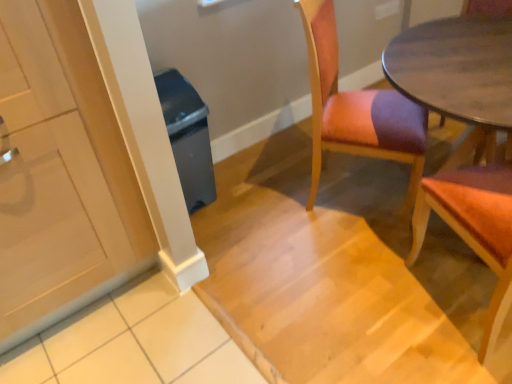
The height and width of the screenshot is (384, 512). What do you see at coordinates (356, 108) in the screenshot?
I see `wooden upholstered chair at center, acting as the 2th chair starting from the right` at bounding box center [356, 108].

Identify the location of white glossy cabinet at left. The image size is (512, 384). (61, 173).

Image resolution: width=512 pixels, height=384 pixels. What are the coordinates of `wooden upholstered chair at center, acting as the 2th chair starting from the right` in the screenshot? It's located at (356, 108).

Relative to wooden upholstered chair at center, the first chair viewed from the left, is wooden chair at right, marked as the first chair in a right-to-left arrangement, in front or behind?

wooden chair at right, marked as the first chair in a right-to-left arrangement, is positioned closer to the viewer than wooden upholstered chair at center, the first chair viewed from the left.

Considering the relative positions of wooden chair at right, arranged as the 2th chair when viewed from the left, and wooden upholstered chair at center, acting as the 2th chair starting from the right, in the image provided, is wooden chair at right, arranged as the 2th chair when viewed from the left, to the left or to the right of wooden upholstered chair at center, acting as the 2th chair starting from the right,?

Based on their positions, wooden chair at right, arranged as the 2th chair when viewed from the left, is located to the right of wooden upholstered chair at center, acting as the 2th chair starting from the right.

Which of these two, wooden chair at right, marked as the first chair in a right-to-left arrangement, or wooden upholstered chair at center, the first chair viewed from the left, is wider?

With larger width is wooden chair at right, marked as the first chair in a right-to-left arrangement.

From a real-world perspective, who is located lower, wooden chair at right, arranged as the 2th chair when viewed from the left, or wooden upholstered chair at center, the first chair viewed from the left?

wooden chair at right, arranged as the 2th chair when viewed from the left, from a real-world perspective.

Is gray plastic trash can at left spatially inside wooden chair at right, marked as the first chair in a right-to-left arrangement, or outside of it?

The correct answer is: outside.

Which is more to the right, gray plastic trash can at left or wooden chair at right, arranged as the 2th chair when viewed from the left?

From the viewer's perspective, wooden chair at right, arranged as the 2th chair when viewed from the left, appears more on the right side.

Which object is further away from the camera, gray plastic trash can at left or wooden chair at right, marked as the first chair in a right-to-left arrangement?

gray plastic trash can at left is more distant.

From the picture: From a real-world perspective, which is physically above, gray plastic trash can at left or wooden chair at right, arranged as the 2th chair when viewed from the left?

wooden chair at right, arranged as the 2th chair when viewed from the left, from a real-world perspective.

Which of these two, wooden chair at right, arranged as the 2th chair when viewed from the left, or gray plastic trash can at left, is bigger?

wooden chair at right, arranged as the 2th chair when viewed from the left.

Does wooden chair at right, arranged as the 2th chair when viewed from the left, have a greater width compared to gray plastic trash can at left?

Yes, wooden chair at right, arranged as the 2th chair when viewed from the left, is wider than gray plastic trash can at left.

Would you say wooden chair at right, arranged as the 2th chair when viewed from the left, contains gray plastic trash can at left?

That's incorrect, gray plastic trash can at left is not inside wooden chair at right, arranged as the 2th chair when viewed from the left.

Can you tell me how much wooden chair at right, marked as the first chair in a right-to-left arrangement, and gray plastic trash can at left differ in facing direction?

The angle between the facing direction of wooden chair at right, marked as the first chair in a right-to-left arrangement, and the facing direction of gray plastic trash can at left is 154 degrees.

In the scene shown: Would you say wooden upholstered chair at center, acting as the 2th chair starting from the right, is part of white glossy cabinet at left's contents?

No, wooden upholstered chair at center, acting as the 2th chair starting from the right, is located outside of white glossy cabinet at left.

Where is `cabinetry above the wooden upholstered chair at center, the first chair viewed from the left (from a real-world perspective)`? The image size is (512, 384). cabinetry above the wooden upholstered chair at center, the first chair viewed from the left (from a real-world perspective) is located at coordinates (61, 173).

From the picture: Which of these two, white glossy cabinet at left or wooden upholstered chair at center, acting as the 2th chair starting from the right, is wider?

With larger width is white glossy cabinet at left.

Is white glossy cabinet at left oriented towards wooden upholstered chair at center, the first chair viewed from the left?

No, white glossy cabinet at left is not oriented towards wooden upholstered chair at center, the first chair viewed from the left.

From the image's perspective, which one is positioned higher, wooden chair at right, marked as the first chair in a right-to-left arrangement, or white glossy cabinet at left?

white glossy cabinet at left is shown above in the image.

What's the angular difference between wooden chair at right, arranged as the 2th chair when viewed from the left, and white glossy cabinet at left's facing directions?

There is a 154-degree angle between the facing directions of wooden chair at right, arranged as the 2th chair when viewed from the left, and white glossy cabinet at left.

Measure the distance between wooden chair at right, arranged as the 2th chair when viewed from the left, and white glossy cabinet at left.

wooden chair at right, arranged as the 2th chair when viewed from the left, and white glossy cabinet at left are 1.24 meters apart from each other.

Does wooden chair at right, marked as the first chair in a right-to-left arrangement, appear on the left side of white glossy cabinet at left?

No, wooden chair at right, marked as the first chair in a right-to-left arrangement, is not to the left of white glossy cabinet at left.

Is wooden upholstered chair at center, acting as the 2th chair starting from the right, facing towards gray plastic trash can at left?

No, wooden upholstered chair at center, acting as the 2th chair starting from the right, is not aimed at gray plastic trash can at left.

Is wooden upholstered chair at center, the first chair viewed from the left, thinner than gray plastic trash can at left?

Incorrect, the width of wooden upholstered chair at center, the first chair viewed from the left, is not less than that of gray plastic trash can at left.

Where is `trash bin/can lying behind the wooden upholstered chair at center, acting as the 2th chair starting from the right`? This screenshot has width=512, height=384. trash bin/can lying behind the wooden upholstered chair at center, acting as the 2th chair starting from the right is located at coordinates (188, 137).

From a real-world perspective, between wooden upholstered chair at center, acting as the 2th chair starting from the right, and wooden chair at right, marked as the first chair in a right-to-left arrangement, who is vertically lower?

wooden chair at right, marked as the first chair in a right-to-left arrangement, is physically lower.

Does wooden upholstered chair at center, the first chair viewed from the left, have a lesser height compared to wooden chair at right, marked as the first chair in a right-to-left arrangement?

Correct, wooden upholstered chair at center, the first chair viewed from the left, is not as tall as wooden chair at right, marked as the first chair in a right-to-left arrangement.

Is wooden upholstered chair at center, acting as the 2th chair starting from the right, not inside wooden chair at right, marked as the first chair in a right-to-left arrangement?

wooden upholstered chair at center, acting as the 2th chair starting from the right, lies outside wooden chair at right, marked as the first chair in a right-to-left arrangement,'s area.

Can you confirm if wooden upholstered chair at center, acting as the 2th chair starting from the right, is positioned to the right of wooden chair at right, marked as the first chair in a right-to-left arrangement?

Incorrect, wooden upholstered chair at center, acting as the 2th chair starting from the right, is not on the right side of wooden chair at right, marked as the first chair in a right-to-left arrangement.

There is a wooden chair at right, marked as the first chair in a right-to-left arrangement. Where is `chair above it (from a real-world perspective)`? This screenshot has height=384, width=512. chair above it (from a real-world perspective) is located at coordinates (356, 108).

Identify the location of trash bin/can that is on the left side of wooden chair at right, arranged as the 2th chair when viewed from the left. Image resolution: width=512 pixels, height=384 pixels. (188, 137).

Looking at this image, which object lies further to the anchor point wooden chair at right, arranged as the 2th chair when viewed from the left, white glossy cabinet at left or wooden upholstered chair at center, acting as the 2th chair starting from the right?

white glossy cabinet at left is further to wooden chair at right, arranged as the 2th chair when viewed from the left.

Considering their positions, is wooden upholstered chair at center, the first chair viewed from the left, positioned further to gray plastic trash can at left than white glossy cabinet at left?

Among the two, wooden upholstered chair at center, the first chair viewed from the left, is located further to gray plastic trash can at left.

Based on their spatial positions, is gray plastic trash can at left or wooden upholstered chair at center, the first chair viewed from the left, closer to wooden chair at right, marked as the first chair in a right-to-left arrangement?

Among the two, wooden upholstered chair at center, the first chair viewed from the left, is located nearer to wooden chair at right, marked as the first chair in a right-to-left arrangement.

Based on their spatial positions, is wooden upholstered chair at center, the first chair viewed from the left, or gray plastic trash can at left further from wooden chair at right, arranged as the 2th chair when viewed from the left?

gray plastic trash can at left lies further to wooden chair at right, arranged as the 2th chair when viewed from the left, than the other object.

From the image, which object appears to be nearer to wooden upholstered chair at center, the first chair viewed from the left, wooden chair at right, marked as the first chair in a right-to-left arrangement, or gray plastic trash can at left?

Based on the image, wooden chair at right, marked as the first chair in a right-to-left arrangement, appears to be nearer to wooden upholstered chair at center, the first chair viewed from the left.

From the image, which object appears to be nearer to wooden chair at right, marked as the first chair in a right-to-left arrangement, white glossy cabinet at left or gray plastic trash can at left?

The object closer to wooden chair at right, marked as the first chair in a right-to-left arrangement, is gray plastic trash can at left.

From the image, which object appears to be nearer to wooden upholstered chair at center, acting as the 2th chair starting from the right, gray plastic trash can at left or wooden chair at right, arranged as the 2th chair when viewed from the left?

wooden chair at right, arranged as the 2th chair when viewed from the left, is closer to wooden upholstered chair at center, acting as the 2th chair starting from the right.

Which object lies further to the anchor point wooden upholstered chair at center, acting as the 2th chair starting from the right, wooden chair at right, arranged as the 2th chair when viewed from the left, or white glossy cabinet at left?

The object further to wooden upholstered chair at center, acting as the 2th chair starting from the right, is white glossy cabinet at left.

Find the location of a particular element. trash bin/can between white glossy cabinet at left and wooden upholstered chair at center, the first chair viewed from the left, in the horizontal direction is located at coordinates (188, 137).

The width and height of the screenshot is (512, 384). In order to click on chair situated between gray plastic trash can at left and wooden chair at right, arranged as the 2th chair when viewed from the left, from left to right in this screenshot , I will do `click(356, 108)`.

This screenshot has width=512, height=384. What are the coordinates of `chair situated between white glossy cabinet at left and wooden chair at right, marked as the first chair in a right-to-left arrangement, from left to right` in the screenshot? It's located at (356, 108).

Identify the location of trash bin/can located between white glossy cabinet at left and wooden chair at right, arranged as the 2th chair when viewed from the left, in the left-right direction. (188, 137).